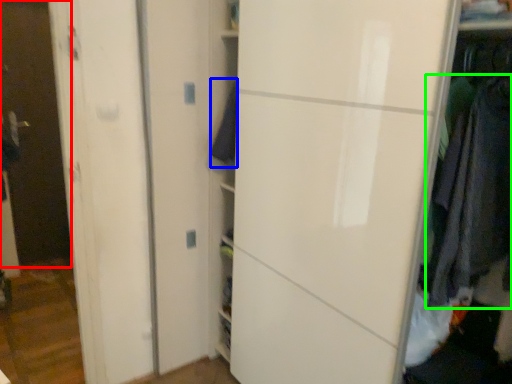
Question: Estimate the real-world distances between objects in this image. Which object is farther from glass door (highlighted by a red box), clothing (highlighted by a blue box) or clothing (highlighted by a green box)?

Choices:
 (A) clothing
 (B) clothing

Answer: (B)